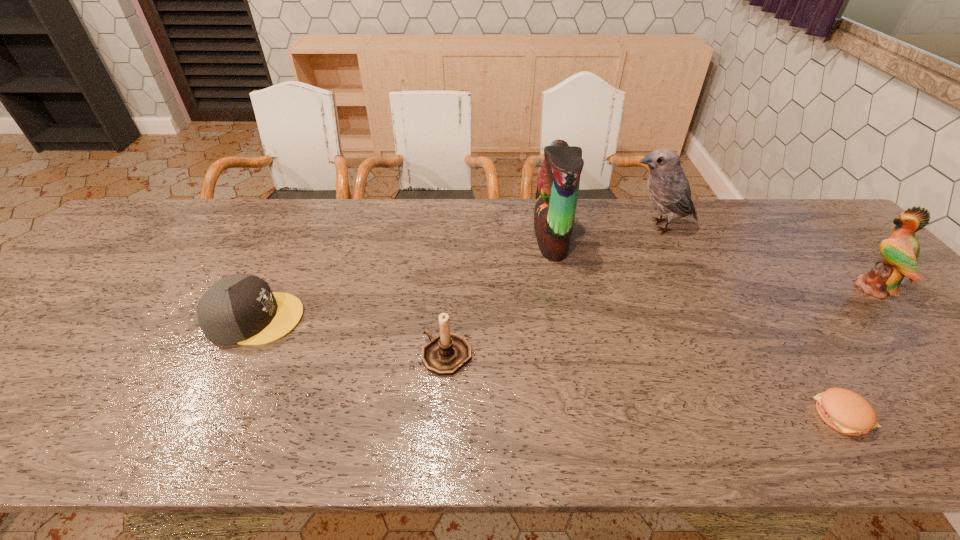
In order to click on the leftmost parrot in this screenshot , I will do `click(558, 181)`.

Identify the location of the second parrot from right to left. (668, 188).

I want to click on the nearest parrot, so click(x=901, y=251).

At what (x,y) coordinates should I click in order to perform the action: click on the rightmost object. Please return your answer as a coordinate pair (x, y). Looking at the image, I should click on (901, 251).

I want to click on candle holder, so click(x=445, y=354).

The width and height of the screenshot is (960, 540). What are the coordinates of `the third shortest object` in the screenshot? It's located at (445, 354).

Identify the location of the second shortest object. (241, 309).

Identify the location of cap. (241, 309).

Locate an element on the screen. The height and width of the screenshot is (540, 960). the second object from right to left is located at coordinates 845,411.

Locate an element on the screen. patty is located at coordinates (845, 411).